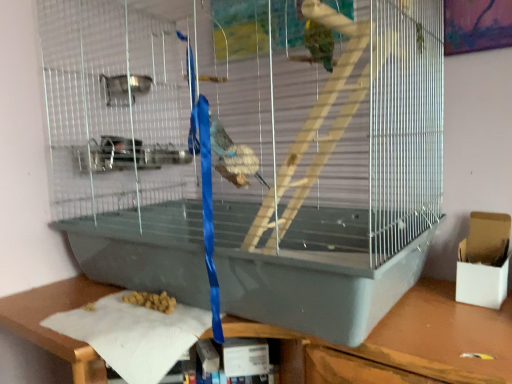
This screenshot has width=512, height=384. I want to click on white cardboard box at right, so [484, 261].

Describe the element at coordinates (484, 261) in the screenshot. I see `white cardboard box at right` at that location.

The image size is (512, 384). I want to click on white cardboard box at right, so [x=484, y=261].